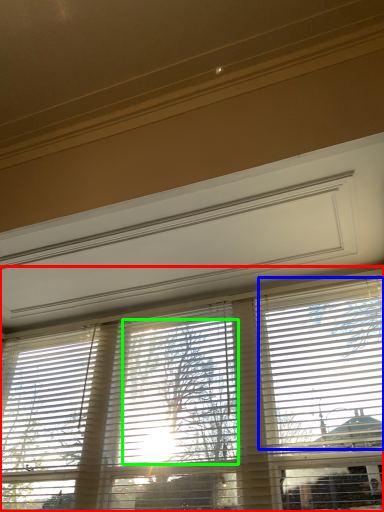
Question: Which object is the closest to the window blind (highlighted by a red box)? Choose among these: blind (highlighted by a blue box) or tree (highlighted by a green box).

Choices:
 (A) blind
 (B) tree

Answer: (B)